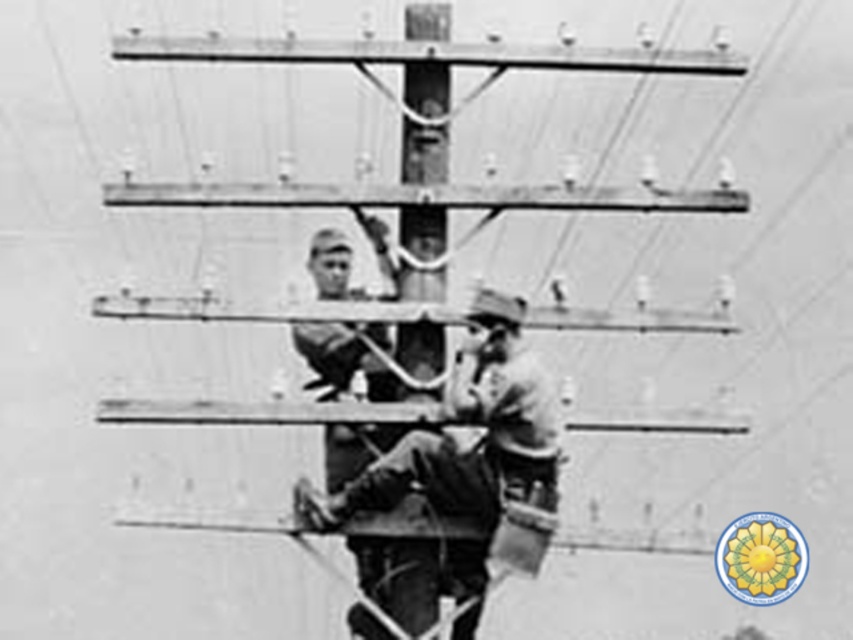
You are a safety inspector reviewing the image of two workers on a utility pole. You notice the smooth leather gloves at center and the smooth wood telegraph pole at center. Which object is shorter in height?

The smooth leather gloves at center are shorter in height compared to the smooth wood telegraph pole at center.

Consider the image. You are a worker on the utility pole and need to reach a point closer to you. Which point should you move towards, point (514, 451) or point (444, 100)?

Point (514, 451) is closer to the viewer, so you should move towards point (514, 451).